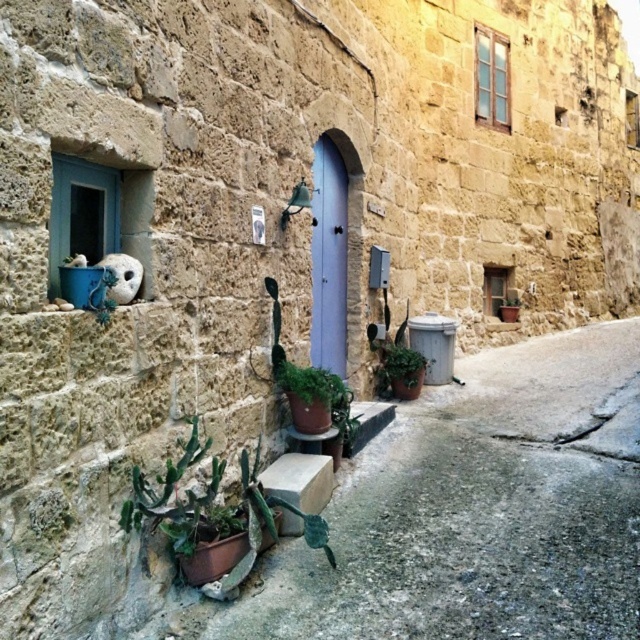
Can you confirm if green succulent at lower left is positioned below green matte plant at lower right?

Correct, green succulent at lower left is located below green matte plant at lower right.

Does point (122, 506) come in front of point (422, 376)?

That is True.

Where is `green succulent at lower left`? green succulent at lower left is located at coordinates (214, 513).

Looking at this image, does green matte plant at center come behind green matte plant at lower right?

That is False.

Can you confirm if green matte plant at center is positioned to the left of green matte plant at lower right?

Correct, you'll find green matte plant at center to the left of green matte plant at lower right.

Between point (292, 385) and point (419, 378), which one is positioned in front?

Point (292, 385)

This screenshot has height=640, width=640. I want to click on green matte plant at center, so 316,401.

Between point (417, 372) and point (131, 300), which one is positioned in front?

Point (131, 300)

Can you confirm if green matte plant at lower right is positioned to the right of white stone cat at upper left?

Indeed, green matte plant at lower right is positioned on the right side of white stone cat at upper left.

Which is in front, point (397, 352) or point (100, 259)?

Point (100, 259) is in front.

The image size is (640, 640). In order to click on green matte plant at lower right in this screenshot , I will do `click(401, 365)`.